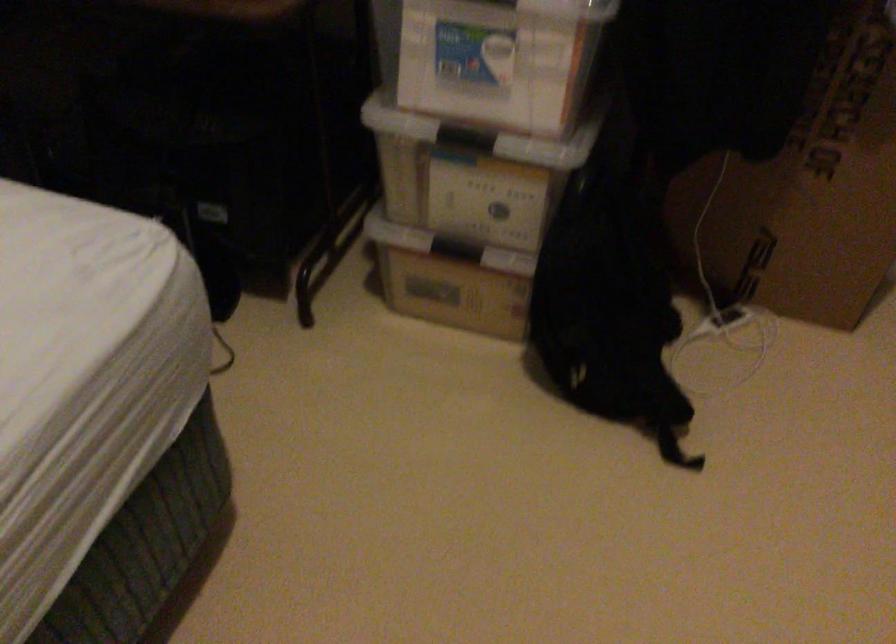
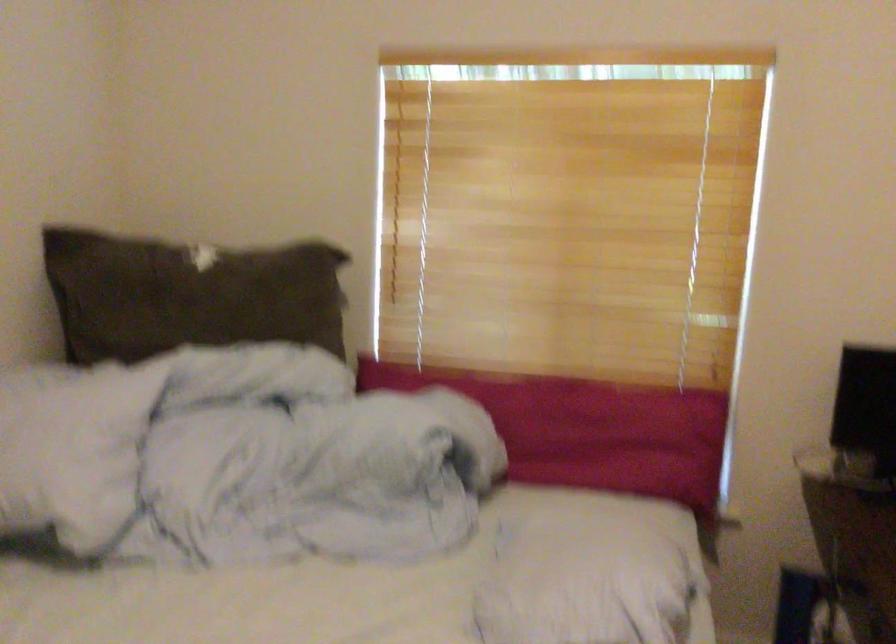
Question: The camera is either moving clockwise (left) or counter-clockwise (right) around the object. The first image is from the beginning of the video and the second image is from the end. Is the camera moving left or right when shooting the video?

Choices:
 (A) Left
 (B) Right

Answer: (B)